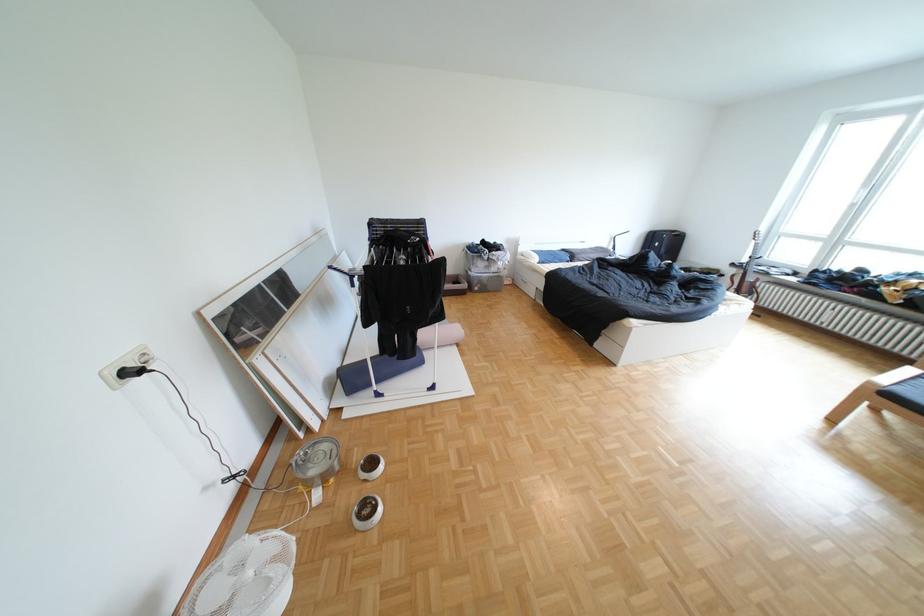
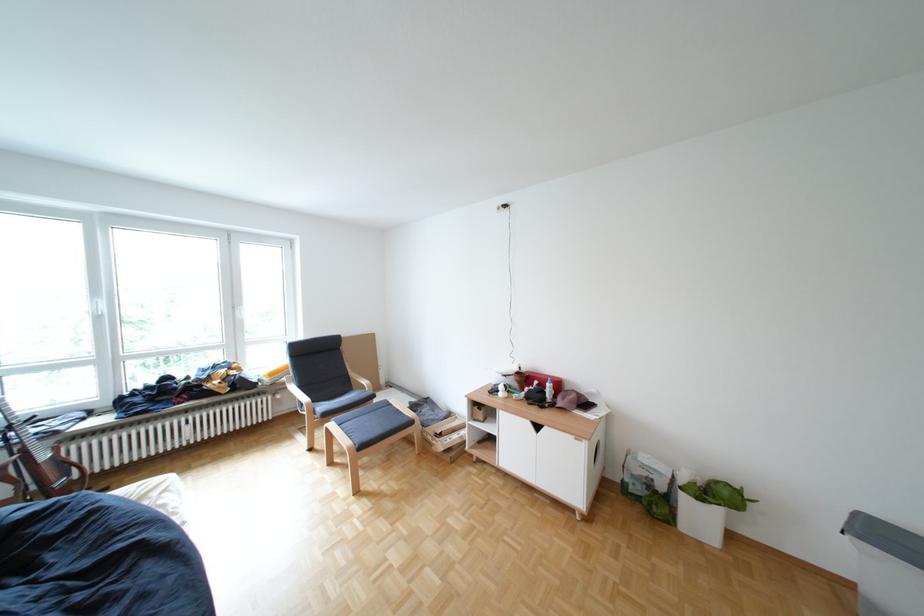
In the second image, find the point that corresponds to point (869, 206) in the first image.

(114, 318)